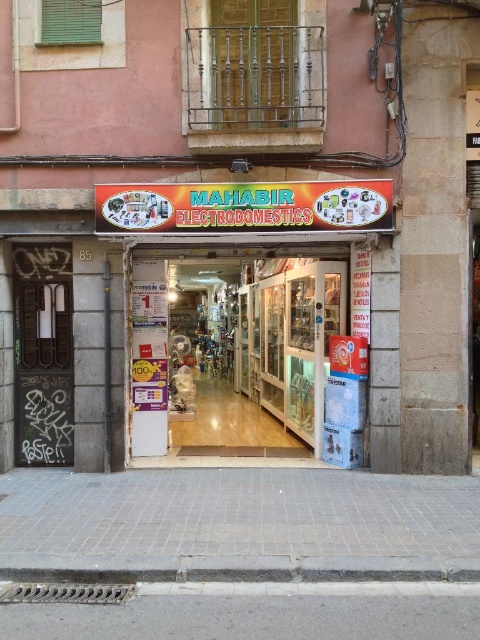
Is grungy metal door at left thinner than gray concrete curb at lower center?

Correct, grungy metal door at left's width is less than gray concrete curb at lower center's.

Consider the image. Can you confirm if grungy metal door at left is wider than gray concrete curb at lower center?

No.

Where is `grungy metal door at left`? grungy metal door at left is located at coordinates (43, 355).

At what (x,y) coordinates should I click in order to perform the action: click on grungy metal door at left. Please return your answer as a coordinate pair (x, y). Image resolution: width=480 pixels, height=640 pixels. Looking at the image, I should click on (43, 355).

Can you confirm if gray concrete pavement at lower center is taller than grungy metal door at left?

No.

Does point (252, 632) come closer to viewer compared to point (56, 369)?

Yes, it is.

Identify the location of gray concrete pavement at lower center. Image resolution: width=480 pixels, height=640 pixels. (248, 618).

Between gray concrete pavement at lower center and gray concrete curb at lower center, which one has more height?

gray concrete curb at lower center

Who is more distant from viewer, (369, 634) or (271, 573)?

The point (271, 573) is more distant.

Between point (243, 600) and point (137, 572), which one is positioned behind?

The point (137, 572) is more distant.

Identify the location of gray concrete pavement at lower center. (248, 618).